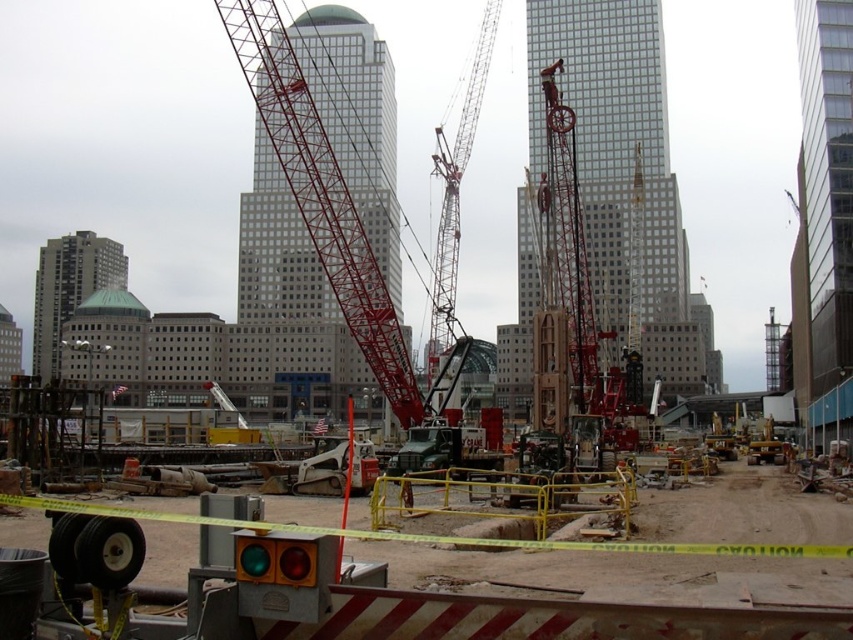
You are a construction worker who needs to move a heavy beam from the gray concrete building at left to the metallic red crane at center. Based on their positions, which direction should you move the beam to reach the crane?

The metallic red crane at center is to the right of the gray concrete building at left, so you should move the beam to the right to reach the crane.